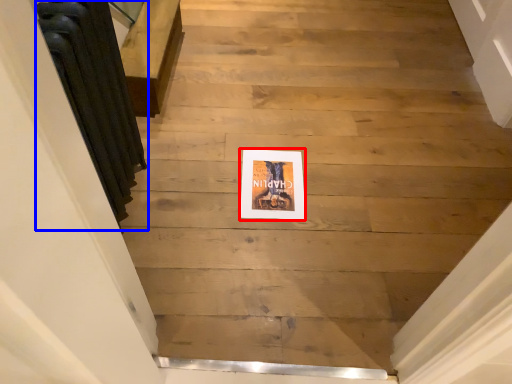
Question: Which object is further to the camera taking this photo, picture frame (highlighted by a red box) or radiator (highlighted by a blue box)?

Choices:
 (A) picture frame
 (B) radiator

Answer: (A)